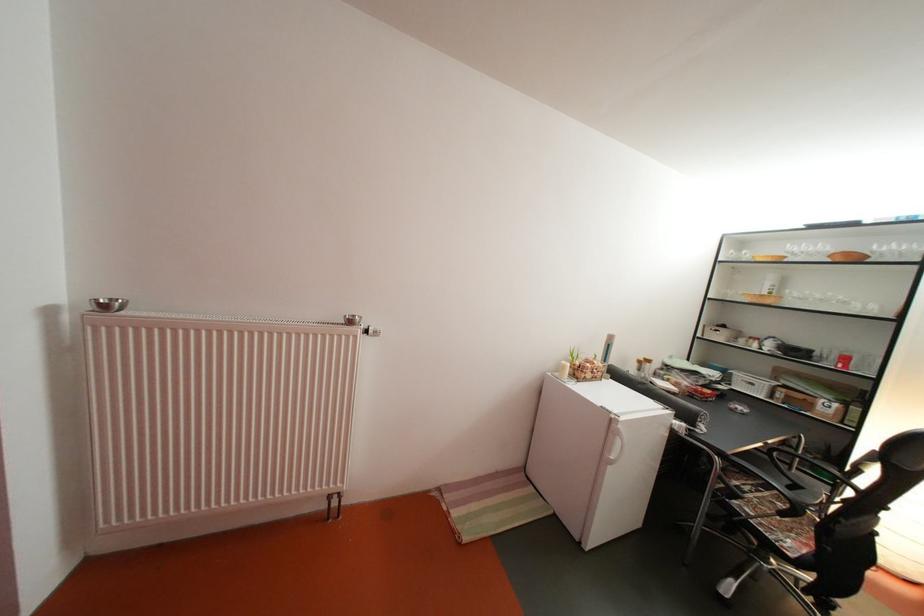
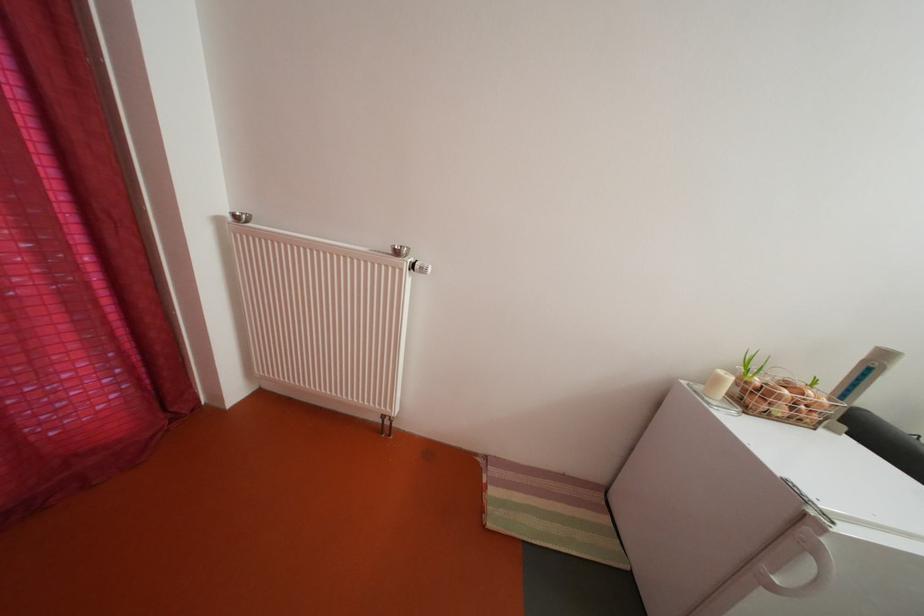
Find the pixel in the second image that matches the point at 382,338 in the first image.

(429, 273)